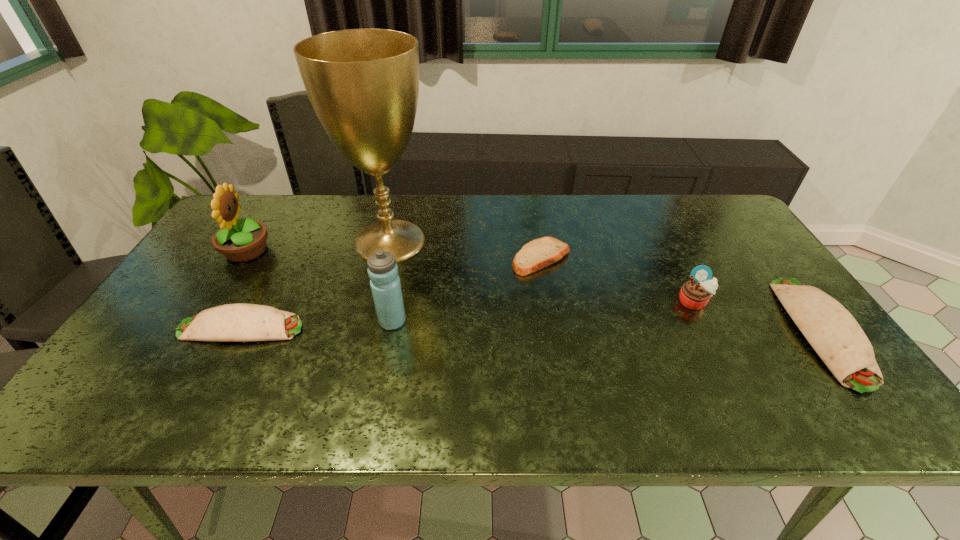
Identify the location of the fifth object from left to right. This screenshot has width=960, height=540. (537, 254).

You are a GUI agent. You are given a task and a screenshot of the screen. Output one action in this format:
    pyautogui.click(x=<x>, y=<y>)
    Task: Click on the vacant region located at the bitten end of the shorter burrito
    This screenshot has height=540, width=960.
    Given the screenshot: What is the action you would take?
    pyautogui.click(x=396, y=328)

The width and height of the screenshot is (960, 540). Identify the location of free region located 0.310m on the left of the trophy cup. (245, 241).

You are a GUI agent. You are given a task and a screenshot of the screen. Output one action in this format:
    pyautogui.click(x=<x>, y=<y>)
    Task: Click on the vacant area located on the front-facing side of the muffin
    This screenshot has width=960, height=540.
    Given the screenshot: What is the action you would take?
    pyautogui.click(x=707, y=327)

You are a GUI agent. You are given a task and a screenshot of the screen. Output one action in this format:
    pyautogui.click(x=<x>, y=<y>)
    Task: Click on the vacant region located on the back of the water bottle
    This screenshot has width=960, height=540.
    Given the screenshot: What is the action you would take?
    pyautogui.click(x=404, y=262)

You are a GUI agent. You are given a task and a screenshot of the screen. Output one action in this format:
    pyautogui.click(x=<x>, y=<y>)
    Task: Click on the free region located 0.260m on the face of the sunflower
    The width and height of the screenshot is (960, 540).
    Given the screenshot: What is the action you would take?
    pyautogui.click(x=357, y=251)

Locate an element on the screen. This screenshot has width=960, height=540. blank space located 0.170m on the right of the shortest object is located at coordinates (629, 258).

You are a GUI agent. You are given a task and a screenshot of the screen. Output one action in this format:
    pyautogui.click(x=<x>, y=<y>)
    Task: Click on the trophy cup present at the far edge
    Image resolution: width=960 pixels, height=540 pixels.
    Given the screenshot: What is the action you would take?
    pyautogui.click(x=363, y=84)

This screenshot has width=960, height=540. In order to click on sunflower that is at the far edge in this screenshot , I will do `click(238, 240)`.

This screenshot has height=540, width=960. What are the coordinates of `object situated at the near edge` in the screenshot? It's located at click(x=835, y=335).